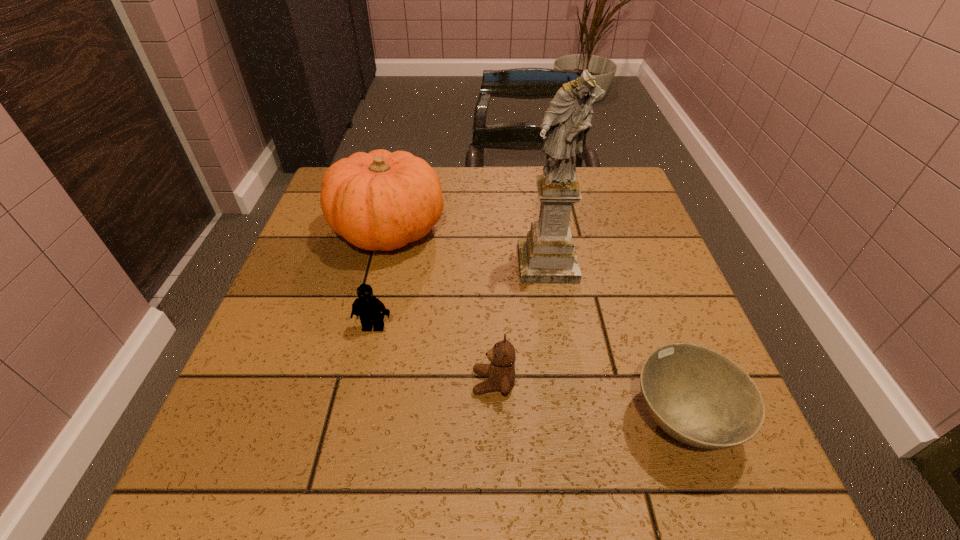
Identify the location of sculpture. (548, 255).

Locate an element on the screen. The width and height of the screenshot is (960, 540). the tallest object is located at coordinates pyautogui.click(x=548, y=255).

At what (x,y) coordinates should I click in order to perform the action: click on the fourth shortest object. Please return your answer as a coordinate pair (x, y). This screenshot has width=960, height=540. Looking at the image, I should click on (381, 200).

Image resolution: width=960 pixels, height=540 pixels. Identify the location of Lego. click(367, 307).

Find the location of a particular element. the third object from right to left is located at coordinates click(500, 372).

The width and height of the screenshot is (960, 540). Identify the location of bowl. (698, 396).

Identify the location of the shortest object. This screenshot has width=960, height=540. (698, 396).

Identify the location of free space located on the front-facing side of the sculpture. The image size is (960, 540). (565, 373).

At what (x,y) coordinates should I click in order to perform the action: click on blank space located 0.270m on the front of the fourth shortest object. Please return your answer as a coordinate pair (x, y). Image resolution: width=960 pixels, height=540 pixels. Looking at the image, I should click on (354, 369).

This screenshot has width=960, height=540. What are the coordinates of `vacant space located 0.310m on the face of the Lego` in the screenshot? It's located at (335, 499).